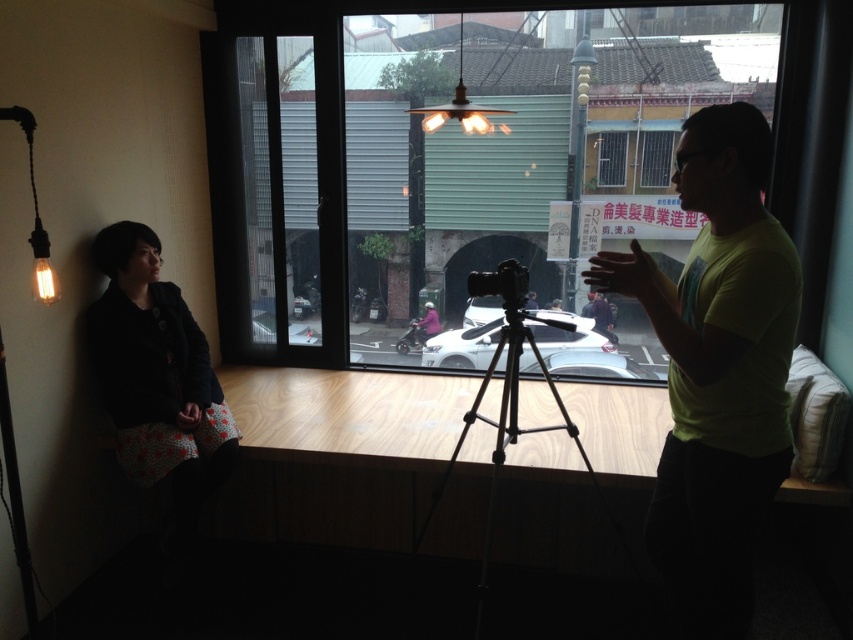
You are standing in the room and want to take a photo of the urban street outside through the transparent glass window at center. However, the yellow matte shirt at center is blocking your view. Can you move the camera to the right to capture the window without the shirt blocking it?

The transparent glass window at center is to the left of the yellow matte shirt at center. Moving the camera to the right would position it away from the shirt, allowing an unobstructed view of the window and the urban street outside.

You are standing in the room and want to take a photo of the urban street outside through the transparent glass window at center. The camera on the table is 1.2 meters away from you. Can you reach the camera to take the photo without moving from your current position?

The transparent glass window at center is 3.76 meters away from the viewer, and the camera on the table is 1.2 meters away from you. Since the camera is closer to you than the window, you can reach the camera to take the photo without moving.

You are a photographer setting up a shot in this room. You want to capture the yellow matte shirt at center through the transparent glass window at center. Is the window positioned in a way that allows you to frame the shirt properly?

The transparent glass window at center is positioned over the yellow matte shirt at center, so yes, the window is placed directly above the shirt, allowing you to frame it effectively in your shot.